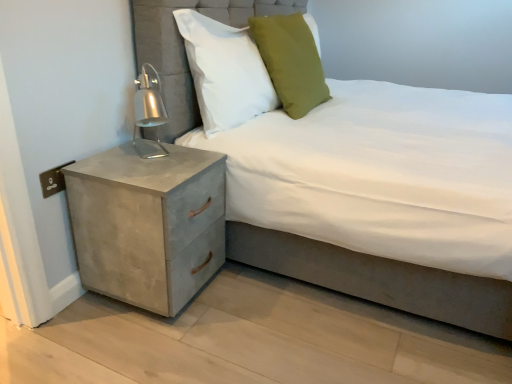
Question: Considering the relative positions of concrete textured nightstand at lower left and white fabric pillow at upper center, which ranks as the second pillow in right-to-left order, in the image provided, is concrete textured nightstand at lower left to the left or to the right of white fabric pillow at upper center, which ranks as the second pillow in right-to-left order,?

Choices:
 (A) left
 (B) right

Answer: (A)

Question: From the image's perspective, relative to white fabric pillow at upper center, which ranks as the second pillow in right-to-left order, is concrete textured nightstand at lower left above or below?

Choices:
 (A) below
 (B) above

Answer: (A)

Question: Estimate the real-world distances between objects in this image. Which object is closer to the concrete textured nightstand at lower left?

Choices:
 (A) green fabric pillow at upper center, placed as the second pillow when sorted from left to right
 (B) white fabric pillow at upper center, which ranks as the second pillow in right-to-left order
 (C) suede-like gray bed at center

Answer: (C)

Question: Considering the real-world distances, which object is farthest from the white fabric pillow at upper center, the 1th pillow when ordered from left to right?

Choices:
 (A) green fabric pillow at upper center, placed as the second pillow when sorted from left to right
 (B) suede-like gray bed at center
 (C) concrete textured nightstand at lower left

Answer: (B)